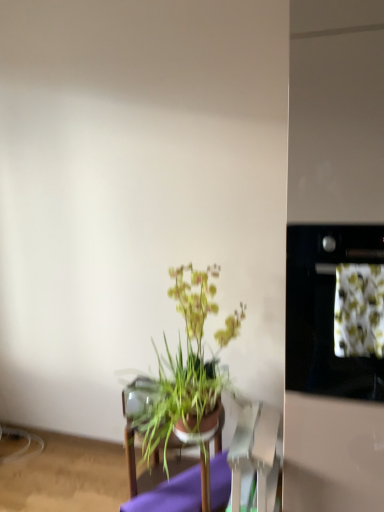
Question: Can you confirm if stainless steel oven at right is thinner than green leafy plant at center?

Choices:
 (A) no
 (B) yes

Answer: (A)

Question: Is stainless steel oven at right positioned in front of green leafy plant at center?

Choices:
 (A) no
 (B) yes

Answer: (B)

Question: Can you confirm if stainless steel oven at right is taller than green leafy plant at center?

Choices:
 (A) no
 (B) yes

Answer: (B)

Question: From the image's perspective, is stainless steel oven at right below green leafy plant at center?

Choices:
 (A) no
 (B) yes

Answer: (A)

Question: Does stainless steel oven at right contain green leafy plant at center?

Choices:
 (A) yes
 (B) no

Answer: (B)

Question: Is stainless steel oven at right not within green leafy plant at center?

Choices:
 (A) no
 (B) yes

Answer: (B)

Question: Is green leafy plant at center shorter than green leafy plant at center?

Choices:
 (A) no
 (B) yes

Answer: (A)

Question: Can you confirm if green leafy plant at center is bigger than green leafy plant at center?

Choices:
 (A) no
 (B) yes

Answer: (B)

Question: Considering the relative sizes of green leafy plant at center and green leafy plant at center in the image provided, is green leafy plant at center thinner than green leafy plant at center?

Choices:
 (A) yes
 (B) no

Answer: (B)

Question: Can you confirm if green leafy plant at center is positioned to the left of green leafy plant at center?

Choices:
 (A) yes
 (B) no

Answer: (A)

Question: Is green leafy plant at center aimed at green leafy plant at center?

Choices:
 (A) no
 (B) yes

Answer: (A)

Question: Considering the relative sizes of green leafy plant at center and green leafy plant at center in the image provided, is green leafy plant at center taller than green leafy plant at center?

Choices:
 (A) yes
 (B) no

Answer: (A)

Question: Considering the relative sizes of green leafy plant at center and green leafy plant at center in the image provided, is green leafy plant at center taller than green leafy plant at center?

Choices:
 (A) no
 (B) yes

Answer: (A)